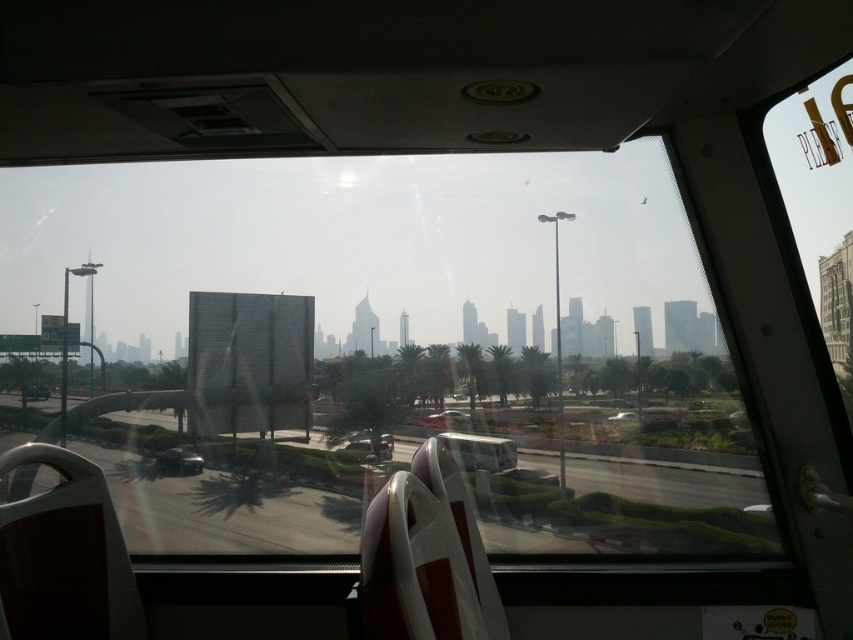
You are a passenger sitting in the vehicle and looking out the window. You see the transparent glass train window at center and the metallic silver bus at center. Which object is higher from the ground?

The transparent glass train window at center is higher from the ground than the metallic silver bus at center because it is positioned above it.

You are a delivery person needing to place a package that is 4 meters long between the transparent glass train window at center and the metallic silver bus at center. Can the space between them accommodate the package?

The transparent glass train window at center and metallic silver bus at center are 4.31 meters apart, so yes, the space between them can accommodate the 4 meters long package since it is slightly longer than the package.

You are a passenger sitting in the vehicle and want to look outside through the transparent glass train window at center. However, there is a metallic silver bus at center blocking your view. Can you see the cityscape outside through the window? Explain why or why not based on their sizes.

The transparent glass train window at center is bigger than metallic silver bus at center, so the window is larger than the bus blocking it. Since the window is bigger, you can still see parts of the cityscape outside around the metallic silver bus at center.